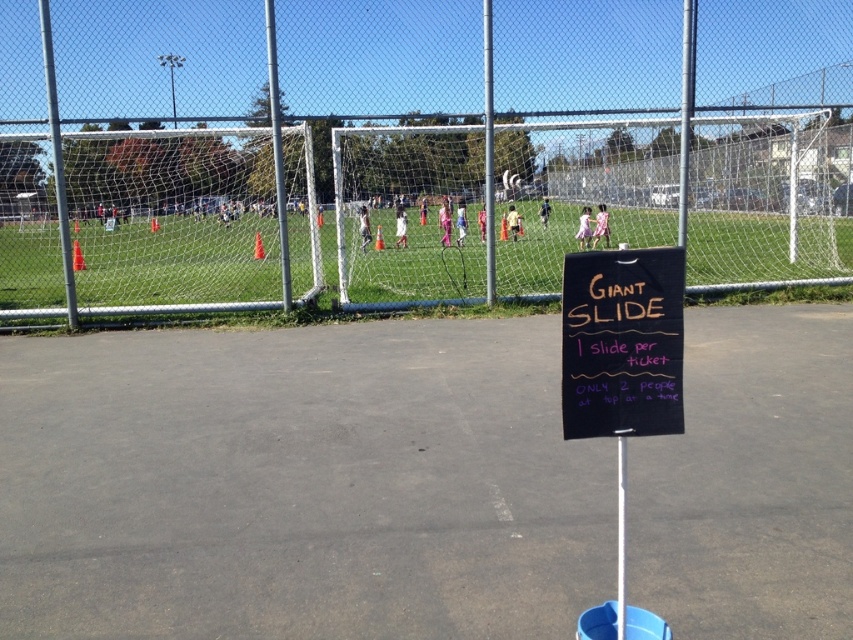
Can you confirm if black chalkboard at center is positioned below silver metallic pole at left?

Indeed, black chalkboard at center is positioned under silver metallic pole at left.

What are the coordinates of `black chalkboard at center` in the screenshot? It's located at (622, 342).

In the scene shown: Who is lower down, black chalkboard at center or metallic silver pole at center?

black chalkboard at center is below.

Based on the photo, is black chalkboard at center below metallic silver pole at center?

Indeed, black chalkboard at center is positioned under metallic silver pole at center.

Identify the location of black chalkboard at center. (622, 342).

At what (x,y) coordinates should I click in order to perform the action: click on black chalkboard at center. Please return your answer as a coordinate pair (x, y). Looking at the image, I should click on (622, 342).

Does green grass at center have a lesser width compared to silver metallic pole at left?

In fact, green grass at center might be wider than silver metallic pole at left.

Is green grass at center in front of silver metallic pole at left?

That is False.

Between point (460, 305) and point (59, 237), which one is positioned behind?

Point (460, 305)

Identify the location of green grass at center. This screenshot has width=853, height=640. (177, 308).